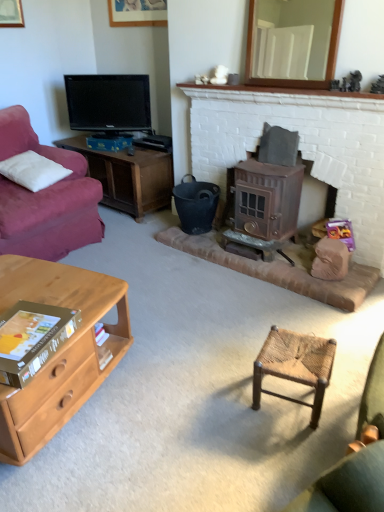
Question: Can you confirm if black glossy tv at upper left is smaller than light brown wood desk at lower left?

Choices:
 (A) no
 (B) yes

Answer: (B)

Question: From the image's perspective, would you say black glossy tv at upper left is shown under light brown wood desk at lower left?

Choices:
 (A) yes
 (B) no

Answer: (B)

Question: Is black glossy tv at upper left bigger than light brown wood desk at lower left?

Choices:
 (A) yes
 (B) no

Answer: (B)

Question: Is black glossy tv at upper left far away from light brown wood desk at lower left?

Choices:
 (A) no
 (B) yes

Answer: (B)

Question: Does black glossy tv at upper left have a greater width compared to light brown wood desk at lower left?

Choices:
 (A) yes
 (B) no

Answer: (B)

Question: Does black glossy tv at upper left lie behind light brown wood desk at lower left?

Choices:
 (A) yes
 (B) no

Answer: (A)

Question: Is woven wood stool at center positioned before white brick fireplace at upper center?

Choices:
 (A) yes
 (B) no

Answer: (A)

Question: Is woven wood stool at center surrounding white brick fireplace at upper center?

Choices:
 (A) yes
 (B) no

Answer: (B)

Question: Considering the relative positions of woven wood stool at center and white brick fireplace at upper center in the image provided, is woven wood stool at center behind white brick fireplace at upper center?

Choices:
 (A) no
 (B) yes

Answer: (A)

Question: Is woven wood stool at center to the right of white brick fireplace at upper center from the viewer's perspective?

Choices:
 (A) no
 (B) yes

Answer: (A)

Question: From a real-world perspective, is woven wood stool at center located beneath white brick fireplace at upper center?

Choices:
 (A) yes
 (B) no

Answer: (A)

Question: Is woven wood stool at center oriented away from white brick fireplace at upper center?

Choices:
 (A) no
 (B) yes

Answer: (A)

Question: Is bronze metallic wood burning stove at center-right inside black matte bucket at center?

Choices:
 (A) no
 (B) yes

Answer: (A)